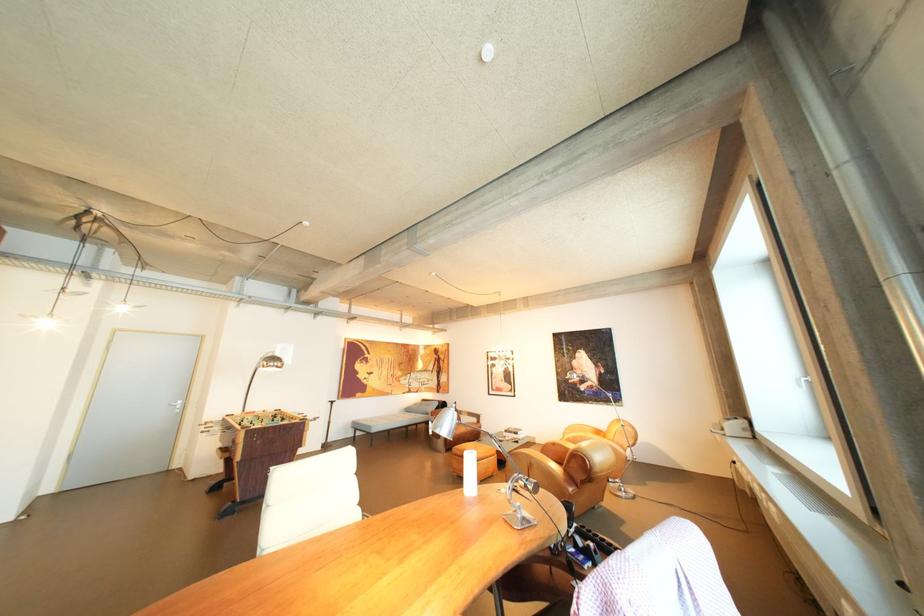
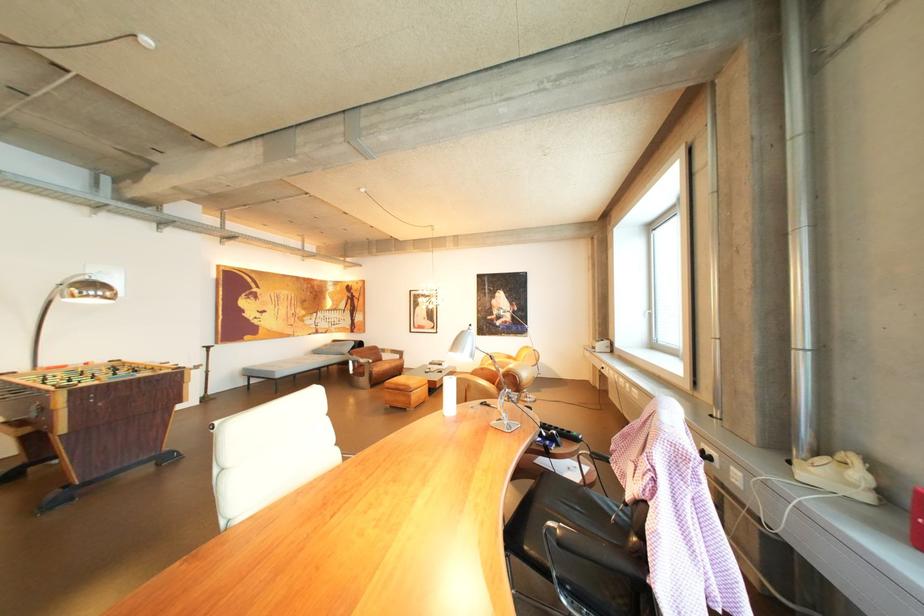
The point at (x=383, y=428) is marked in the first image. Where is the corresponding point in the second image?

(286, 373)